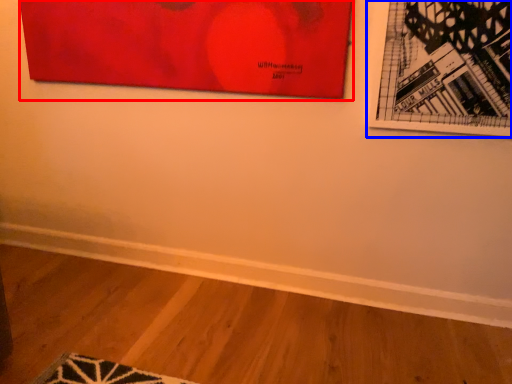
Question: Among these objects, which one is nearest to the camera, picture frame (highlighted by a red box) or picture frame (highlighted by a blue box)?

Choices:
 (A) picture frame
 (B) picture frame

Answer: (B)